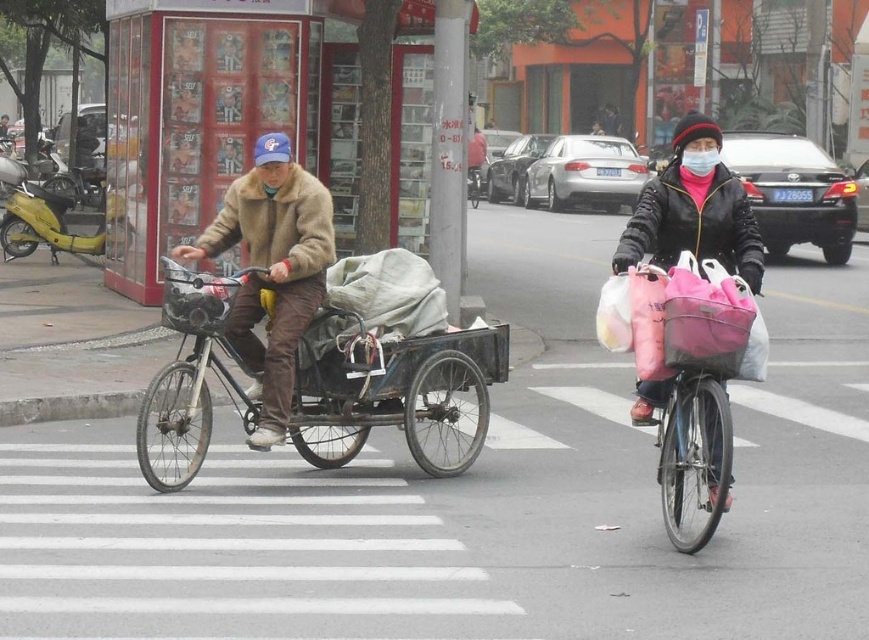
Question: Which object is the farthest from the brown fuzzy coat at left?

Choices:
 (A) rusty metal cart at center
 (B) black leather jacket at center
 (C) pink fabric bag at center

Answer: (C)

Question: Does rusty metal cart at center have a larger size compared to brown fuzzy coat at left?

Choices:
 (A) no
 (B) yes

Answer: (B)

Question: Does black leather jacket at center have a greater width compared to pink fabric bag at center?

Choices:
 (A) yes
 (B) no

Answer: (A)

Question: Which point appears farthest from the camera in this image?

Choices:
 (A) (206, 243)
 (B) (415, 365)
 (C) (695, 374)
 (D) (706, 129)

Answer: (B)

Question: Which of the following is the closest to the observer?

Choices:
 (A) (637, 257)
 (B) (690, 392)
 (C) (348, 349)

Answer: (A)

Question: Can you confirm if brown fuzzy coat at left is positioned to the right of black leather jacket at center?

Choices:
 (A) no
 (B) yes

Answer: (A)